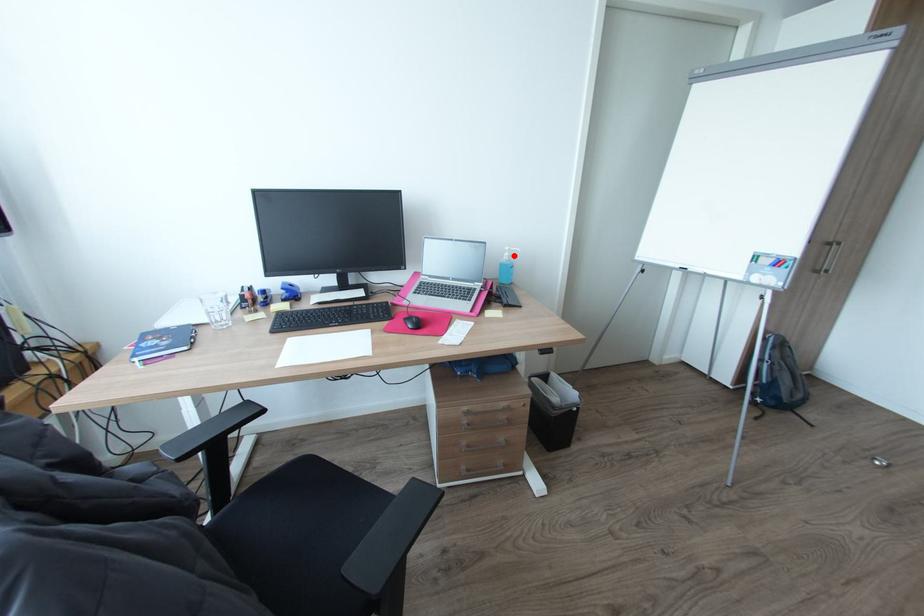
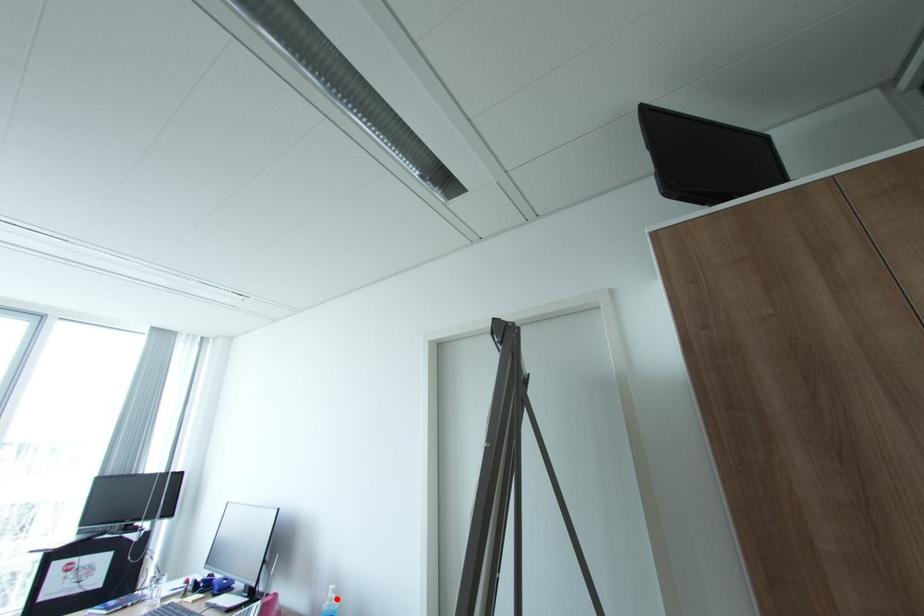
I am providing you with two images of the same scene from different viewpoints. A red point is marked on the first image and another point is marked on the second image. Does the point marked in image1 correspond to the same location as the one in image2?

Yes